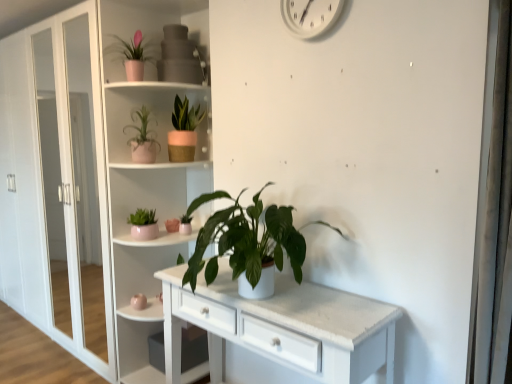
Question: From a real-world perspective, is white plastic clock at upper center positioned above or below matte pink pot at upper center, which is counted as the 3th houseplant, starting from the bottom?

Choices:
 (A) above
 (B) below

Answer: (A)

Question: Looking at the image, does white plastic clock at upper center seem bigger or smaller compared to matte pink pot at upper center, placed as the third houseplant when sorted from top to bottom?

Choices:
 (A) big
 (B) small

Answer: (B)

Question: Which object is the farthest from the matte pink pot at upper center, placed as the third houseplant when sorted from top to bottom?

Choices:
 (A) green matte plant at center, arranged as the fifth houseplant when viewed from the top
 (B) pink matte pot at upper center, the fourth houseplant positioned from the bottom
 (C) matte pink pot at center-left, which is the 4th houseplant from top to bottom
 (D) white plastic clock at upper center
 (E) white glossy shelves at center

Answer: (D)

Question: Which is farther from the green matte plant at center, arranged as the fifth houseplant when viewed from the top?

Choices:
 (A) matte pink vase at center
 (B) matte pink pot at upper left, marked as the 1th houseplant in a top-to-bottom arrangement
 (C) white plastic clock at upper center
 (D) pink matte pot at upper center, the fourth houseplant positioned from the bottom
 (E) matte pink pot at center-left, which is the 4th houseplant from top to bottom

Answer: (B)